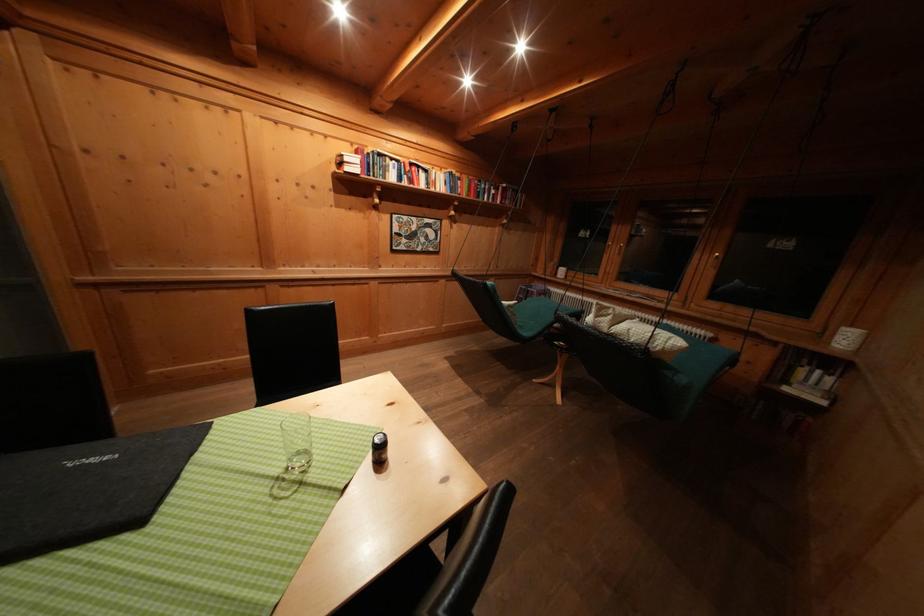
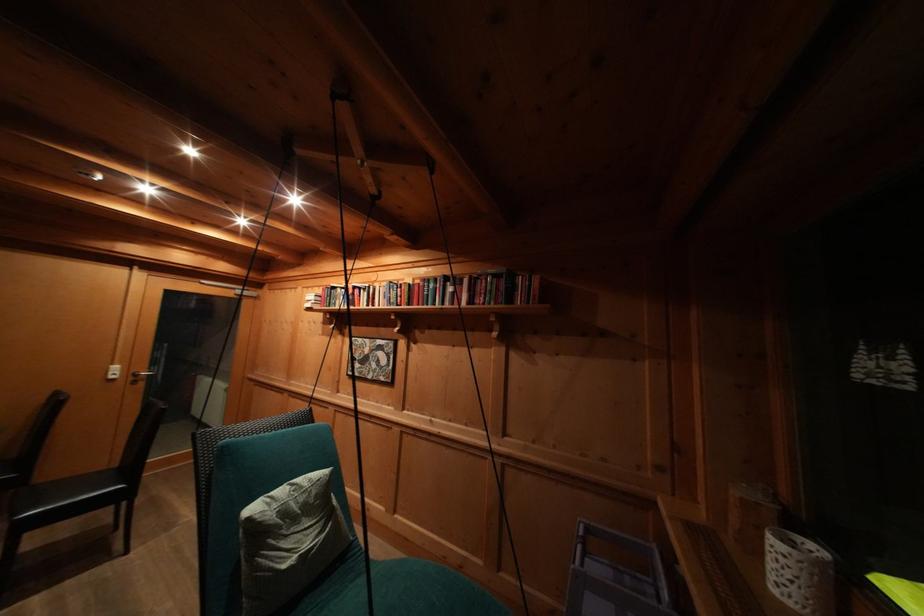
The point at (489, 191) is marked in the first image. Where is the corresponding point in the second image?

(438, 291)